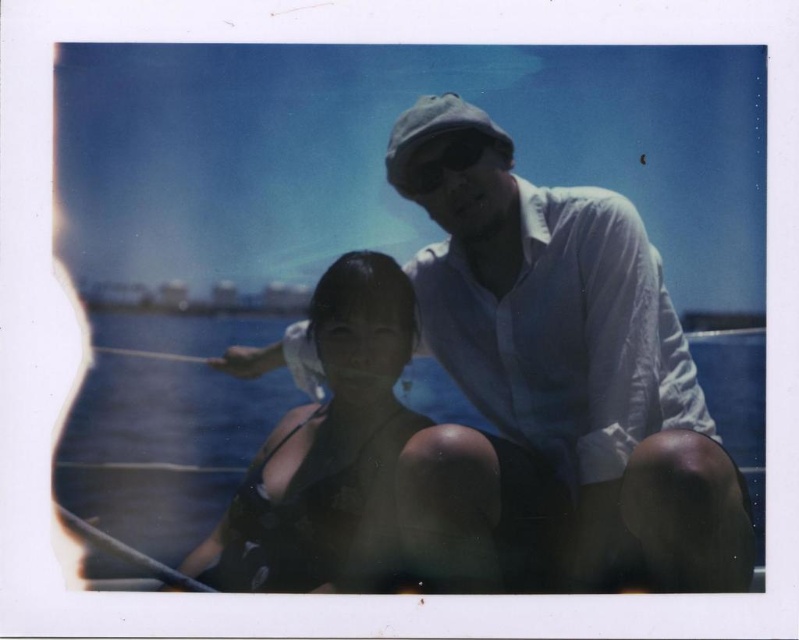
Question: Where is white cotton shirt at upper center located in relation to clear blue water at center in the image?

Choices:
 (A) right
 (B) left

Answer: (A)

Question: Which point is closer to the camera?

Choices:
 (A) black matte swimsuit at center
 (B) white cotton shirt at upper center

Answer: (B)

Question: Is clear blue water at center thinner than black matte swimsuit at center?

Choices:
 (A) yes
 (B) no

Answer: (B)

Question: Which object appears farthest from the camera in this image?

Choices:
 (A) white cotton shirt at upper center
 (B) clear blue water at center

Answer: (B)

Question: Which object is closer to the camera taking this photo?

Choices:
 (A) clear blue water at center
 (B) black matte swimsuit at center
 (C) white cotton shirt at upper center

Answer: (C)

Question: Is the position of white cotton shirt at upper center more distant than that of black matte swimsuit at center?

Choices:
 (A) no
 (B) yes

Answer: (A)